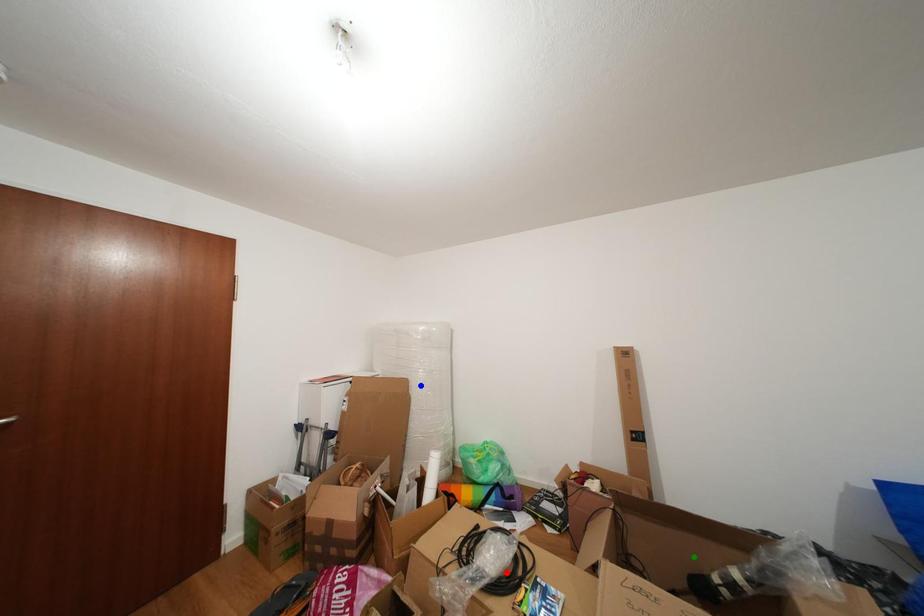
Order these from nearest to farthest:
- green point
- blue point
- red point

blue point < red point < green point